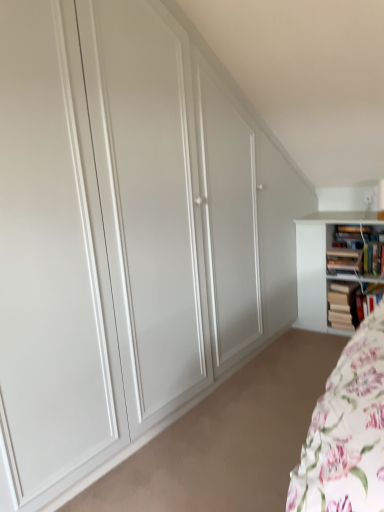
Question: From the image's perspective, is wooden book at right, which appears as the 3th book when viewed from the top, below wooden bookshelf at right, the second book when ordered from top to bottom?

Choices:
 (A) yes
 (B) no

Answer: (A)

Question: Can you confirm if wooden book at right, which appears as the 3th book when viewed from the top, is shorter than wooden bookshelf at right, the 3th book positioned from the bottom?

Choices:
 (A) yes
 (B) no

Answer: (B)

Question: Is wooden book at right, marked as the 2th book in a bottom-to-top arrangement, oriented away from wooden bookshelf at right, the second book when ordered from top to bottom?

Choices:
 (A) yes
 (B) no

Answer: (B)

Question: Considering the relative sizes of wooden book at right, marked as the 2th book in a bottom-to-top arrangement, and wooden bookshelf at right, the second book when ordered from top to bottom, in the image provided, is wooden book at right, marked as the 2th book in a bottom-to-top arrangement, wider than wooden bookshelf at right, the second book when ordered from top to bottom,?

Choices:
 (A) no
 (B) yes

Answer: (B)

Question: Does wooden book at right, which appears as the 3th book when viewed from the top, have a lesser width compared to wooden bookshelf at right, the 3th book positioned from the bottom?

Choices:
 (A) yes
 (B) no

Answer: (B)

Question: Is wooden book at right, marked as the 2th book in a bottom-to-top arrangement, positioned before wooden bookshelf at right, the second book when ordered from top to bottom?

Choices:
 (A) no
 (B) yes

Answer: (A)

Question: Does hardcover books at upper right, which ranks as the first book in top-to-bottom order, have a larger size compared to hardcover book at right, placed as the fourth book when sorted from top to bottom?

Choices:
 (A) no
 (B) yes

Answer: (B)

Question: Is hardcover book at right, which is counted as the first book, starting from the bottom, at the back of hardcover books at upper right, which ranks as the first book in top-to-bottom order?

Choices:
 (A) yes
 (B) no

Answer: (B)

Question: Is hardcover books at upper right, the fourth book when ordered from bottom to top, at the right side of hardcover book at right, which is counted as the first book, starting from the bottom?

Choices:
 (A) no
 (B) yes

Answer: (A)

Question: Does hardcover books at upper right, which ranks as the first book in top-to-bottom order, have a greater height compared to hardcover book at right, which is counted as the first book, starting from the bottom?

Choices:
 (A) no
 (B) yes

Answer: (B)

Question: Does hardcover books at upper right, the fourth book when ordered from bottom to top, contain hardcover book at right, placed as the fourth book when sorted from top to bottom?

Choices:
 (A) no
 (B) yes

Answer: (A)

Question: From a real-world perspective, is hardcover books at upper right, which ranks as the first book in top-to-bottom order, positioned under hardcover book at right, placed as the fourth book when sorted from top to bottom, based on gravity?

Choices:
 (A) no
 (B) yes

Answer: (A)

Question: Does wooden book at right, which appears as the 3th book when viewed from the top, appear on the right side of hardcover book at right, which is counted as the first book, starting from the bottom?

Choices:
 (A) yes
 (B) no

Answer: (B)